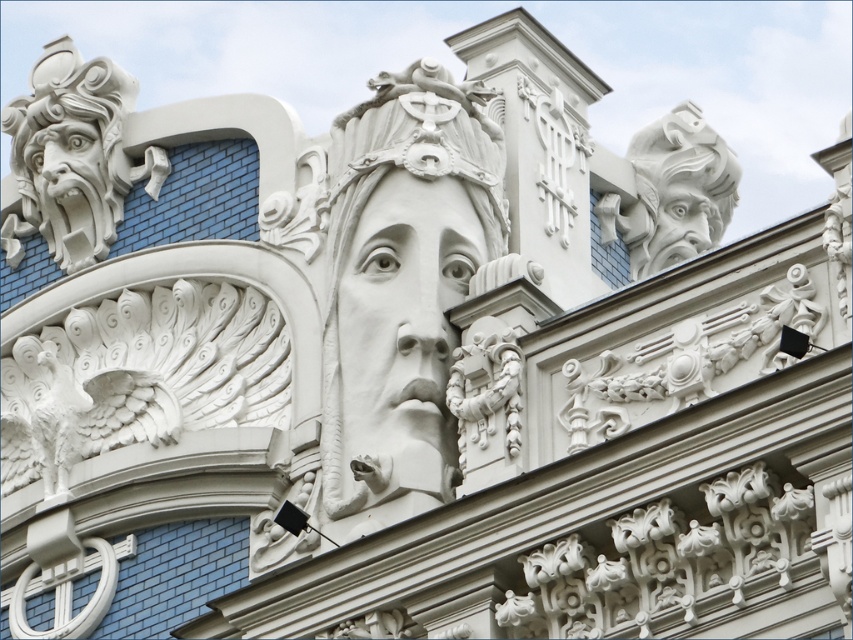
Which is more to the left, white stone face at center or white stone gargoyle at upper right?

From the viewer's perspective, white stone face at center appears more on the left side.

Which is in front, point (474, 84) or point (659, 216)?

Positioned in front is point (474, 84).

You are a GUI agent. You are given a task and a screenshot of the screen. Output one action in this format:
    pyautogui.click(x=<x>, y=<y>)
    Task: Click on the white stone face at center
    Image resolution: width=853 pixels, height=640 pixels.
    Given the screenshot: What is the action you would take?
    pyautogui.click(x=402, y=280)

Describe the element at coordinates (402, 280) in the screenshot. The image size is (853, 640). I see `white stone face at center` at that location.

Is point (368, 276) behind point (444, 220)?

Yes, it is.

Where is `white stone face at center`? The image size is (853, 640). white stone face at center is located at coordinates pos(402,280).

From the picture: Who is positioned more to the left, white stone sculpture at center or white stone gargoyle at upper right?

Positioned to the left is white stone sculpture at center.

Is the position of white stone sculpture at center more distant than that of white stone gargoyle at upper right?

No, white stone sculpture at center is in front of white stone gargoyle at upper right.

Is point (469, 211) positioned before point (724, 144)?

That is True.

This screenshot has height=640, width=853. I want to click on white stone sculpture at center, so click(x=401, y=301).